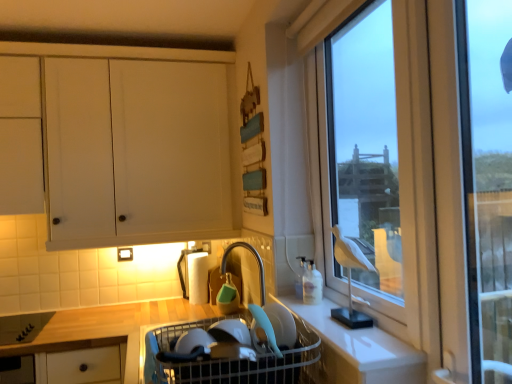
Locate an element on the screen. This screenshot has width=512, height=384. white matte cabinet at upper left is located at coordinates (126, 140).

What do you see at coordinates (265, 327) in the screenshot? I see `matte plastic bowl at lower center` at bounding box center [265, 327].

What do you see at coordinates (357, 349) in the screenshot? The height and width of the screenshot is (384, 512). I see `white matte counter at lower right` at bounding box center [357, 349].

Image resolution: width=512 pixels, height=384 pixels. Identify the location of transparent glass window at right. (396, 173).

Measure the distance between transparent glass window at right and camera.

A distance of 98.88 centimeters exists between transparent glass window at right and camera.

At what (x,y) coordinates should I click in order to perform the action: click on white matte cabinet at upper left. Please return your answer as a coordinate pair (x, y). The image size is (512, 384). Looking at the image, I should click on (126, 140).

From the picture: Between transparent glass window at right and white matte counter at lower right, which one has less height?

With less height is white matte counter at lower right.

Considering the positions of point (330, 188) and point (367, 361), is point (330, 188) closer or farther from the camera than point (367, 361)?

Point (330, 188).

From the image's perspective, which is above, transparent glass window at right or white matte counter at lower right?

transparent glass window at right is shown above in the image.

Is transparent glass window at right facing away from white matte counter at lower right?

No, white matte counter at lower right is not at the back of transparent glass window at right.

Between transparent glass window at right and white matte cabinet at upper left, which one has larger size?

white matte cabinet at upper left.

In terms of height, does transparent glass window at right look taller or shorter compared to white matte cabinet at upper left?

Considering their sizes, transparent glass window at right has more height than white matte cabinet at upper left.

The image size is (512, 384). In order to click on cabinetry located on the left of transparent glass window at right in this screenshot , I will do `click(126, 140)`.

Which object is closer to the camera, transparent glass window at right or white matte cabinet at upper left?

transparent glass window at right is closer to the camera.

Is white matte counter at lower right spatially inside transparent glass window at right, or outside of it?

The correct answer is: outside.

Considering the points (340, 324) and (496, 301), which point is in front, point (340, 324) or point (496, 301)?

The point (340, 324) is closer.

From the image's perspective, is white matte counter at lower right located beneath transparent glass window at right?

Yes.

Which object is further away from the camera taking this photo, white matte counter at lower right or transparent glass window at right?

transparent glass window at right is behind.

Is point (170, 353) closer to camera compared to point (88, 68)?

Yes.

Is white plastic sink at center turned away from white matte cabinet at upper left?

That's not correct — white plastic sink at center is not looking away from white matte cabinet at upper left.

Considering the relative sizes of white plastic sink at center and white matte cabinet at upper left in the image provided, is white plastic sink at center bigger than white matte cabinet at upper left?

No, white plastic sink at center is not bigger than white matte cabinet at upper left.

Which object is closer to the camera, white plastic sink at center or white matte cabinet at upper left?

Positioned in front is white plastic sink at center.

Is white matte cabinet at upper left at the left side of white plastic sink at center?

Yes.

Between white matte cabinet at upper left and white plastic sink at center, which one has larger width?

white plastic sink at center.

Which of these two, white matte cabinet at upper left or white plastic sink at center, stands shorter?

With less height is white plastic sink at center.

In terms of size, does white matte cabinet at upper left appear bigger or smaller than matte plastic bowl at lower center?

In the image, white matte cabinet at upper left appears to be larger than matte plastic bowl at lower center.

The image size is (512, 384). In order to click on appliance to the right of white matte cabinet at upper left in this screenshot , I will do `click(265, 327)`.

In the image, is white matte cabinet at upper left on the left side or the right side of matte plastic bowl at lower center?

Based on their positions, white matte cabinet at upper left is located to the left of matte plastic bowl at lower center.

Is white matte cabinet at upper left positioned beyond the bounds of matte plastic bowl at lower center?

Yes, white matte cabinet at upper left is located beyond the bounds of matte plastic bowl at lower center.

Which is less distant, (169,237) or (339,346)?

Clearly, point (169,237) is more distant from the camera than point (339,346).

Is white matte cabinet at upper left bigger than white matte counter at lower right?

Yes.

Who is more distant, white matte cabinet at upper left or white matte counter at lower right?

white matte cabinet at upper left is behind.

Is white matte counter at lower right inside white matte cabinet at upper left?

No, white matte counter at lower right is not a part of white matte cabinet at upper left.

You are a GUI agent. You are given a task and a screenshot of the screen. Output one action in this format:
    pyautogui.click(x=<x>, y=<y>)
    Task: Click on the counter on the left side of transparent glass window at right
    The width and height of the screenshot is (512, 384).
    Given the screenshot: What is the action you would take?
    pyautogui.click(x=357, y=349)

The height and width of the screenshot is (384, 512). In order to click on window below the white matte cabinet at upper left (from a real-world perspective) in this screenshot , I will do `click(396, 173)`.

Which object lies nearer to the anchor point white matte cabinet at upper left, white plastic sink at center or matte plastic bowl at lower center?

Among the two, white plastic sink at center is located nearer to white matte cabinet at upper left.

Which object lies further to the anchor point white plastic sink at center, white matte cabinet at upper left or matte plastic bowl at lower center?

white matte cabinet at upper left lies further to white plastic sink at center than the other object.

Considering their positions, is matte plastic bowl at lower center positioned further to white matte cabinet at upper left than white matte counter at lower right?

matte plastic bowl at lower center is positioned further to the anchor white matte cabinet at upper left.

When comparing their distances from transparent glass window at right, does white matte counter at lower right or white matte cabinet at upper left seem closer?

white matte counter at lower right is closer to transparent glass window at right.

Looking at the image, which one is located further to transparent glass window at right, white plastic sink at center or white matte counter at lower right?

white plastic sink at center is further to transparent glass window at right.

Which object lies further to the anchor point transparent glass window at right, matte plastic bowl at lower center or white plastic sink at center?

The object further to transparent glass window at right is matte plastic bowl at lower center.

Consider the image. Which object lies further to the anchor point white plastic sink at center, white matte cabinet at upper left or white matte counter at lower right?

Based on the image, white matte cabinet at upper left appears to be further to white plastic sink at center.

From the image, which object appears to be nearer to matte plastic bowl at lower center, white matte counter at lower right or transparent glass window at right?

The object closer to matte plastic bowl at lower center is white matte counter at lower right.

The image size is (512, 384). I want to click on appliance between white matte cabinet at upper left and transparent glass window at right, so click(265, 327).

The width and height of the screenshot is (512, 384). In order to click on appliance that lies between transparent glass window at right and white plastic sink at center from top to bottom in this screenshot , I will do `click(265, 327)`.

Where is `counter between transparent glass window at right and white plastic sink at center vertically`? The width and height of the screenshot is (512, 384). counter between transparent glass window at right and white plastic sink at center vertically is located at coordinates (357, 349).

Locate an element on the screen. Image resolution: width=512 pixels, height=384 pixels. counter between white matte cabinet at upper left and white plastic sink at center vertically is located at coordinates (357, 349).